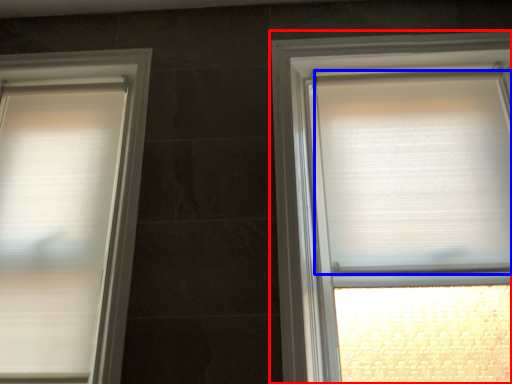
Question: Among these objects, which one is nearest to the camera, window (highlighted by a red box) or blind (highlighted by a blue box)?

Choices:
 (A) window
 (B) blind

Answer: (A)